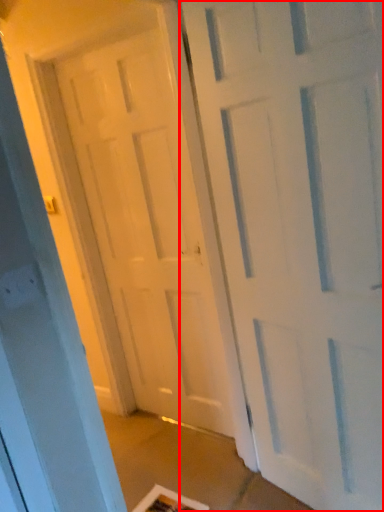
Question: Where is door (annotated by the red box) located in relation to door in the image?

Choices:
 (A) right
 (B) left

Answer: (A)